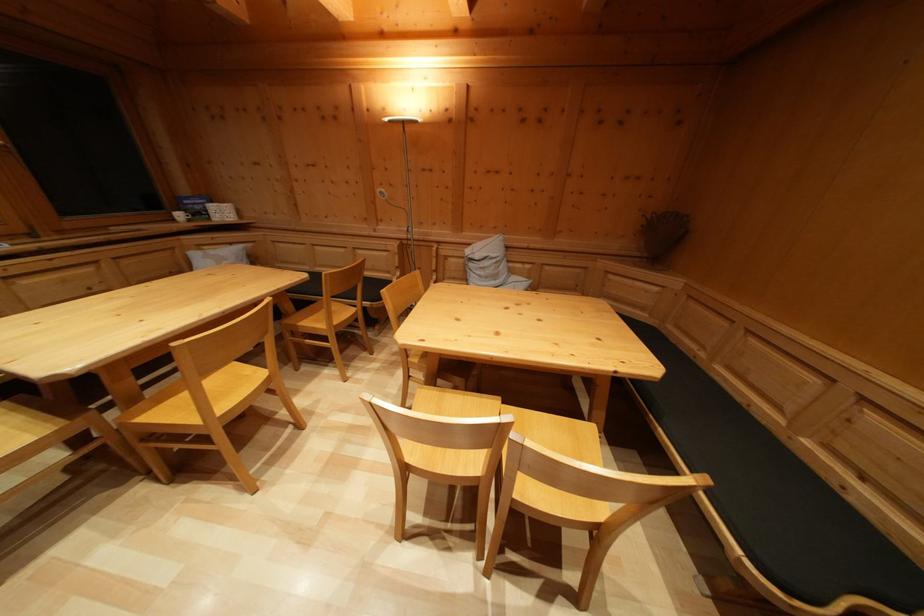
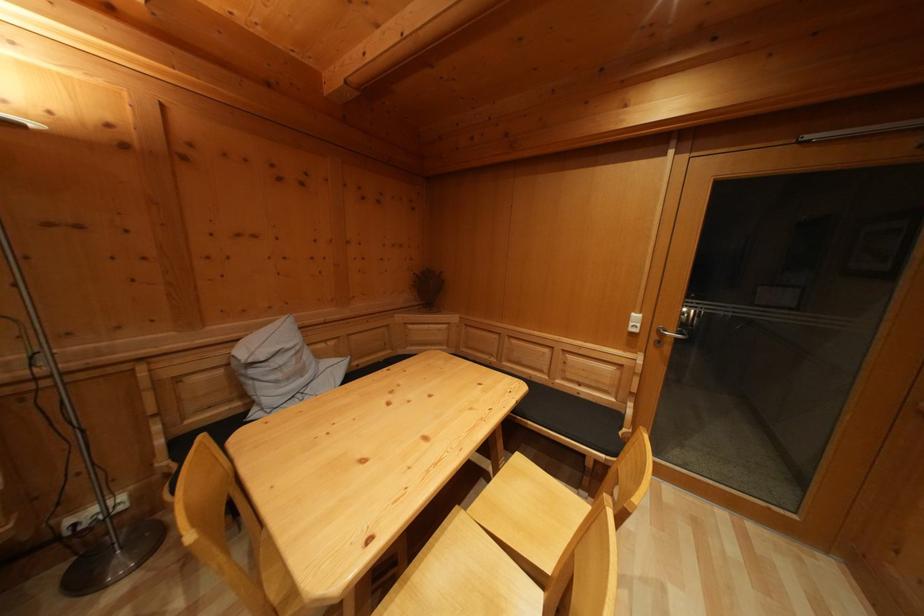
Question: The camera is either moving clockwise (left) or counter-clockwise (right) around the object. The first image is from the beginning of the video and the second image is from the end. Is the camera moving left or right when shooting the video?

Choices:
 (A) Left
 (B) Right

Answer: (A)